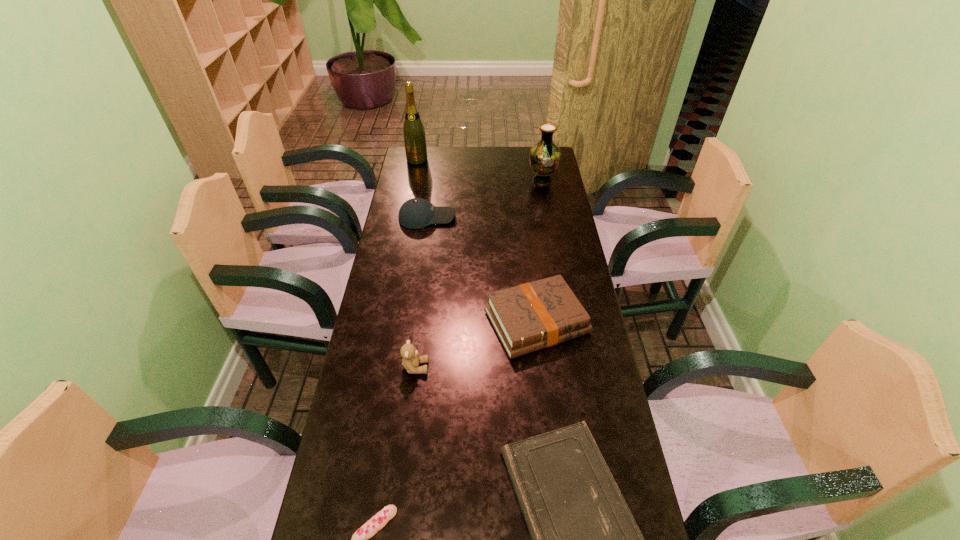
Where is `vacant region located 0.060m on the front-facing side of the baseball cap`? vacant region located 0.060m on the front-facing side of the baseball cap is located at coordinates 470,217.

Image resolution: width=960 pixels, height=540 pixels. I want to click on vacant space located 0.100m on the front of the hardback book, so click(x=544, y=391).

In order to click on wine bottle that is at the far edge in this screenshot , I will do `click(413, 131)`.

At what (x,y) coordinates should I click in order to perform the action: click on vase located at the far edge. Please return your answer as a coordinate pair (x, y). This screenshot has height=540, width=960. Looking at the image, I should click on (544, 156).

Where is `wine bottle located in the left edge section of the desktop`? This screenshot has height=540, width=960. wine bottle located in the left edge section of the desktop is located at coordinates pyautogui.click(x=413, y=131).

This screenshot has height=540, width=960. Identify the location of teddy bear positioned at the left edge. (411, 359).

What are the coordinates of `baseball cap present at the left edge` in the screenshot? It's located at (416, 213).

You are a GUI agent. You are given a task and a screenshot of the screen. Output one action in this format:
    pyautogui.click(x=<x>, y=<y>)
    Task: Click on the vase present at the right edge
    The width and height of the screenshot is (960, 540).
    Given the screenshot: What is the action you would take?
    pyautogui.click(x=544, y=156)

Image resolution: width=960 pixels, height=540 pixels. Identify the location of hardback book at the right edge. (532, 316).

In order to click on object located at the far left corner in this screenshot , I will do `click(413, 131)`.